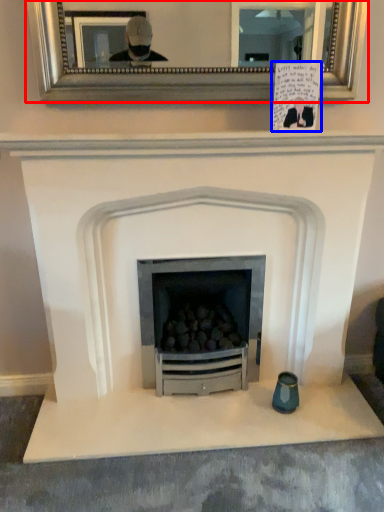
Question: Which object is further to the camera taking this photo, picture frame (highlighted by a red box) or postcard (highlighted by a blue box)?

Choices:
 (A) picture frame
 (B) postcard

Answer: (B)